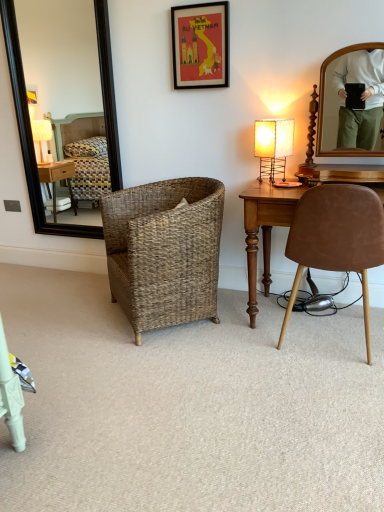
Question: Should I look upward or downward to see black framed mirror at left?

Choices:
 (A) down
 (B) up

Answer: (B)

Question: Can you confirm if red paper picture frame at upper center is positioned to the left of black framed mirror at left?

Choices:
 (A) no
 (B) yes

Answer: (A)

Question: Is red paper picture frame at upper center turned away from black framed mirror at left?

Choices:
 (A) no
 (B) yes

Answer: (A)

Question: Is red paper picture frame at upper center thinner than black framed mirror at left?

Choices:
 (A) no
 (B) yes

Answer: (B)

Question: Considering the relative sizes of red paper picture frame at upper center and black framed mirror at left in the image provided, is red paper picture frame at upper center shorter than black framed mirror at left?

Choices:
 (A) yes
 (B) no

Answer: (A)

Question: Is red paper picture frame at upper center aimed at black framed mirror at left?

Choices:
 (A) yes
 (B) no

Answer: (B)

Question: Considering the relative sizes of red paper picture frame at upper center and black framed mirror at left in the image provided, is red paper picture frame at upper center bigger than black framed mirror at left?

Choices:
 (A) no
 (B) yes

Answer: (A)

Question: Is brown suede chair at right, arranged as the first chair when viewed from the right, facing away from matte beige lamp at right?

Choices:
 (A) yes
 (B) no

Answer: (B)

Question: From a real-world perspective, is brown suede chair at right, arranged as the first chair when viewed from the right, below matte beige lamp at right?

Choices:
 (A) yes
 (B) no

Answer: (A)

Question: From a real-world perspective, is brown suede chair at right, arranged as the first chair when viewed from the right, on top of matte beige lamp at right?

Choices:
 (A) no
 (B) yes

Answer: (A)

Question: Is brown suede chair at right, the 2th chair when ordered from left to right, not close to matte beige lamp at right?

Choices:
 (A) yes
 (B) no

Answer: (B)

Question: Can you confirm if brown suede chair at right, the 2th chair when ordered from left to right, is taller than matte beige lamp at right?

Choices:
 (A) no
 (B) yes

Answer: (B)

Question: Is brown suede chair at right, arranged as the first chair when viewed from the right, to the right of matte beige lamp at right from the viewer's perspective?

Choices:
 (A) no
 (B) yes

Answer: (B)

Question: Does black framed mirror at left have a lesser height compared to matte beige lamp at right?

Choices:
 (A) no
 (B) yes

Answer: (A)